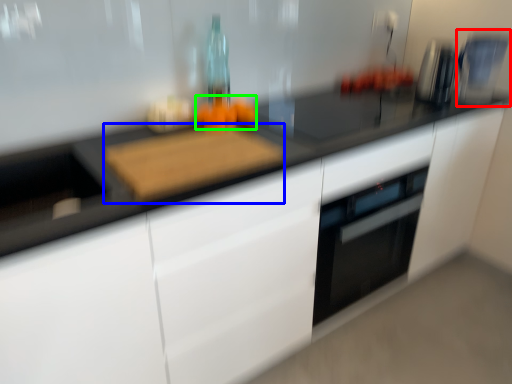
Question: Which object is positioned farthest from coffee machine (highlighted by a red box)? Select from cutting board (highlighted by a blue box) and food (highlighted by a green box).

Choices:
 (A) cutting board
 (B) food

Answer: (A)